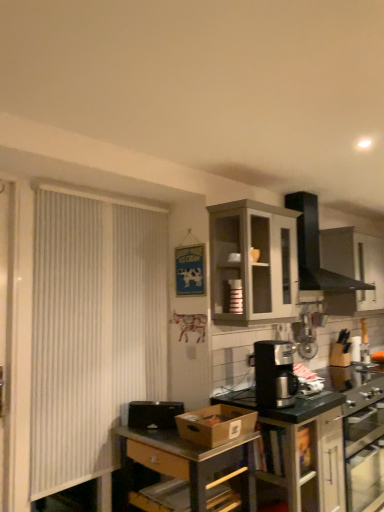
Locate an element on the screen. The image size is (384, 512). vacant space underneath black plastic coffee maker at center (from a real-world perspective) is located at coordinates (281, 405).